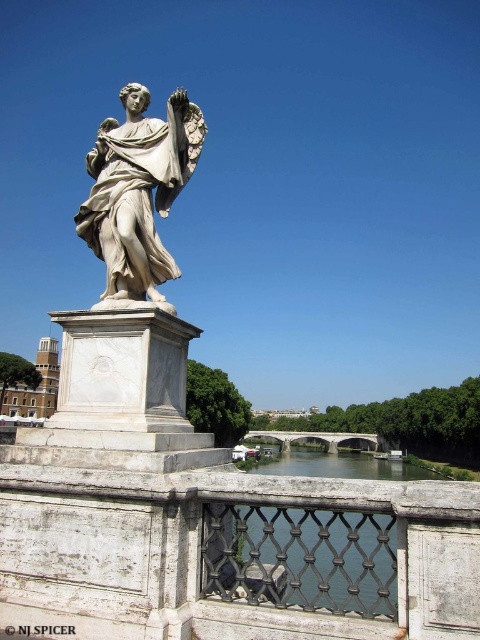
You are an architect examining a 3D model of the statue and pedestal. You notice two points marked on the model at coordinates point(334,470) and point(243,438). Which of these points is nearer to you when viewing the model from the front?

Point(334,470) is closer to the viewer than point(243,438).

You are standing on the bridge and see the white marble statue at center and the clear water at bridge center. Which object is directly above the other?

The white marble statue at center is positioned over clear water at bridge center, so the statue is directly above the water.

You are a sculptor who wants to transport the white marble statue at center and the white stone bridge at center to a new location. If you have a truck bed that is 2 meters wide, will both objects fit side by side?

The white marble statue at center is thinner than the white stone bridge at center. Since the truck bed is 2 meters wide, it depends on the combined width of both objects. However, without specific measurements, we cannot confirm if they will fit side by side.